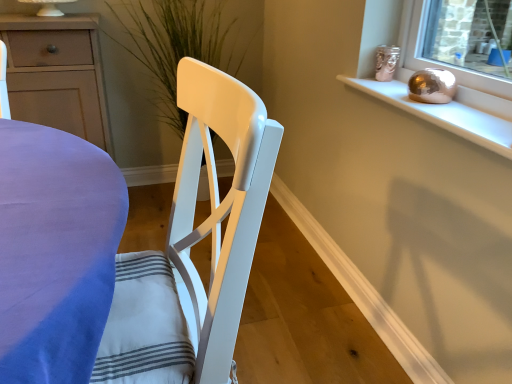
Question: Is the depth of green matte plant at center less than that of metallic gold sphere at upper right?

Choices:
 (A) no
 (B) yes

Answer: (A)

Question: From a real-world perspective, does green matte plant at center stand above metallic gold sphere at upper right?

Choices:
 (A) no
 (B) yes

Answer: (A)

Question: Can you confirm if green matte plant at center is taller than metallic gold sphere at upper right?

Choices:
 (A) no
 (B) yes

Answer: (B)

Question: Is green matte plant at center wider than metallic gold sphere at upper right?

Choices:
 (A) no
 (B) yes

Answer: (B)

Question: Are green matte plant at center and metallic gold sphere at upper right making contact?

Choices:
 (A) yes
 (B) no

Answer: (B)

Question: From the image's perspective, does green matte plant at center appear higher than metallic gold sphere at upper right?

Choices:
 (A) no
 (B) yes

Answer: (B)

Question: Is green matte plant at center further to the viewer compared to matte white cabinet at left?

Choices:
 (A) no
 (B) yes

Answer: (B)

Question: Is green matte plant at center not within matte white cabinet at left?

Choices:
 (A) yes
 (B) no

Answer: (A)

Question: Considering the relative sizes of green matte plant at center and matte white cabinet at left in the image provided, is green matte plant at center smaller than matte white cabinet at left?

Choices:
 (A) no
 (B) yes

Answer: (A)

Question: Does green matte plant at center come in front of matte white cabinet at left?

Choices:
 (A) yes
 (B) no

Answer: (B)

Question: Is green matte plant at center oriented towards matte white cabinet at left?

Choices:
 (A) no
 (B) yes

Answer: (A)

Question: Is green matte plant at center bigger than matte white cabinet at left?

Choices:
 (A) yes
 (B) no

Answer: (A)

Question: Can you confirm if metallic gold sphere at upper right is shorter than matte white cabinet at left?

Choices:
 (A) no
 (B) yes

Answer: (B)